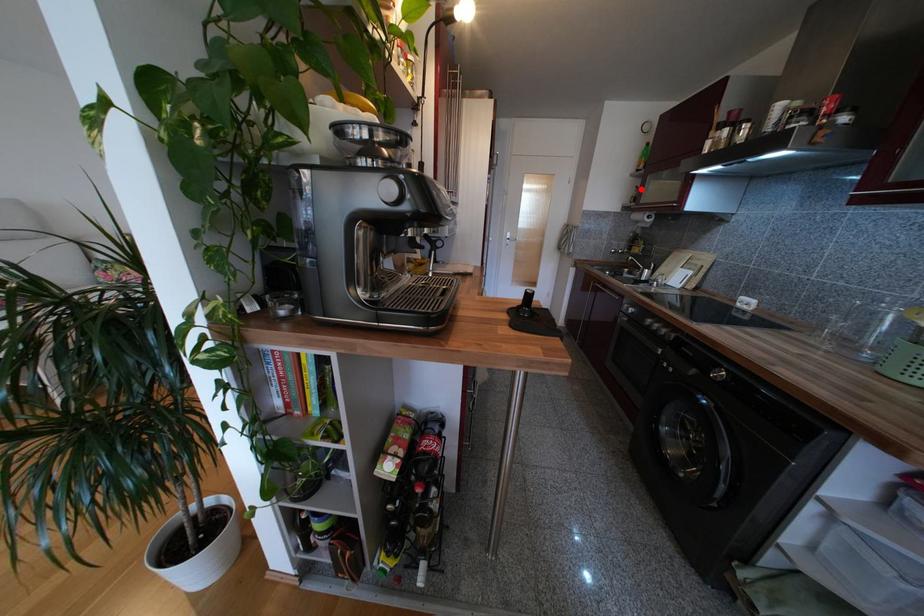
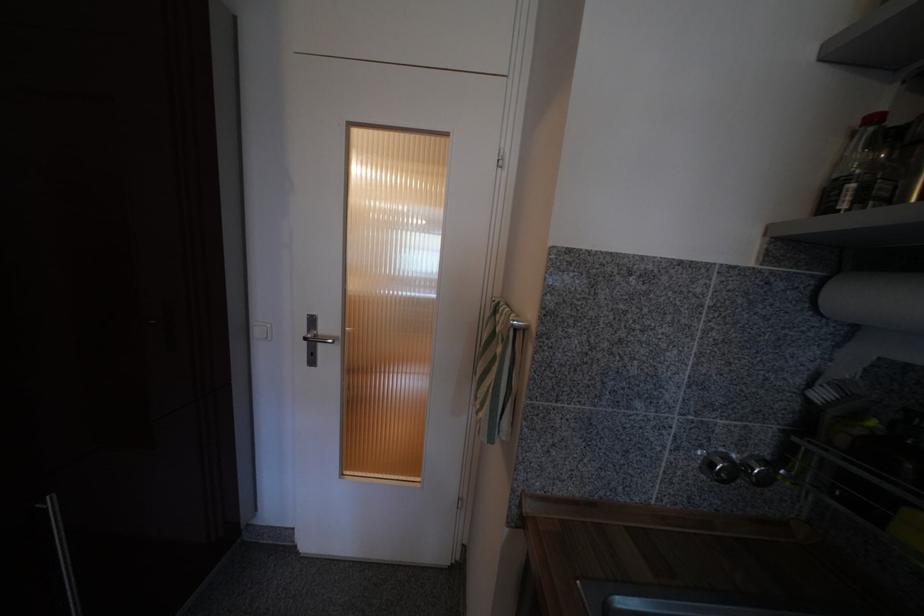
Question: A red point is marked in image1. In image2, is the corresponding 3D point closer to the camera or farther? Reply with the corresponding letter.

Choices:
 (A) The corresponding 3D point is closer.
 (B) The corresponding 3D point is farther.

Answer: (B)